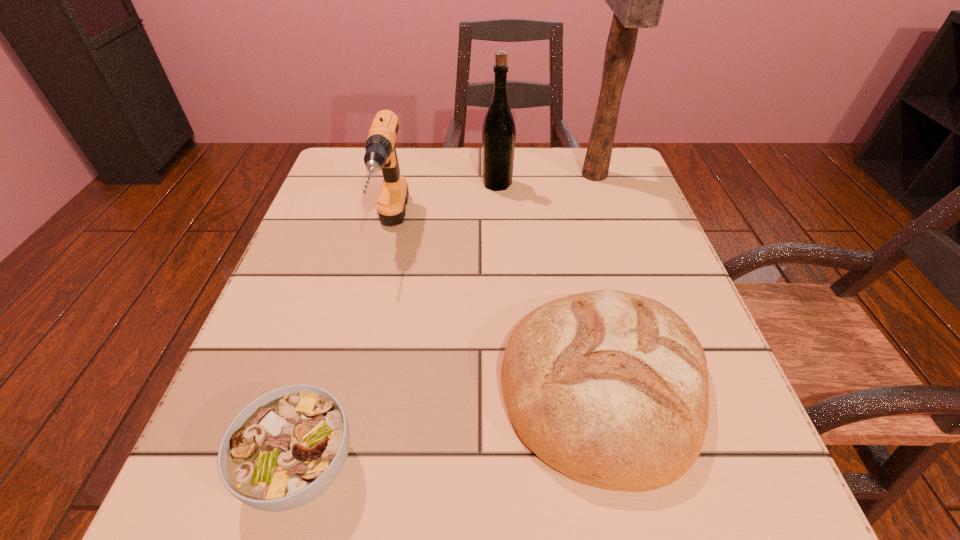
Where is `mallet`? mallet is located at coordinates (637, 0).

Identify the location of the fourth shortest object. The height and width of the screenshot is (540, 960). (498, 132).

At what (x,y) coordinates should I click in order to perform the action: click on drill. Please return your answer as a coordinate pair (x, y). Looking at the image, I should click on (380, 148).

Where is `bread`? The height and width of the screenshot is (540, 960). bread is located at coordinates (610, 388).

You are a GUI agent. You are given a task and a screenshot of the screen. Output one action in this format:
    pyautogui.click(x=<x>, y=<y>)
    Task: Click on the shortest object
    
    Given the screenshot: What is the action you would take?
    pyautogui.click(x=286, y=448)

Find the location of a particular element. vacant region located on the front of the tallest object is located at coordinates (628, 274).

Where is `vacant space situated 0.240m on the right of the beer bottle`? The image size is (960, 540). vacant space situated 0.240m on the right of the beer bottle is located at coordinates (617, 184).

I want to click on blank space located at the tip of the drill, so click(351, 404).

Identify the location of free space located 0.280m on the left of the bread. The width and height of the screenshot is (960, 540). (307, 385).

The width and height of the screenshot is (960, 540). Find the location of `vacant space located on the right of the soup bowl`. vacant space located on the right of the soup bowl is located at coordinates (588, 467).